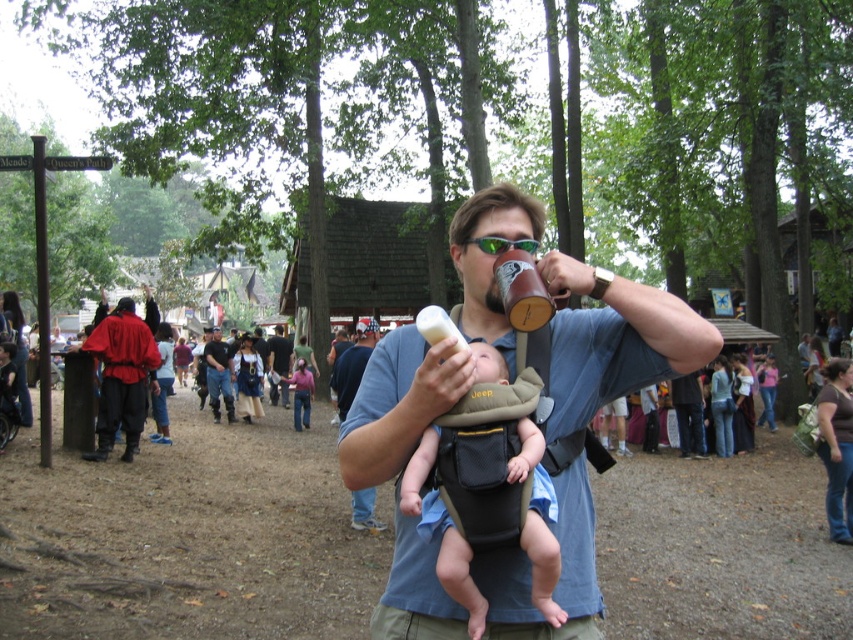
You are a vendor at the medieval fair and need to retrieve your red leather jacket at center from the pile of jackets. Which direction should you move relative to the dark brown leather jacket at center to find it?

The red leather jacket at center is positioned on the right side of dark brown leather jacket at center, so you should move to the right of the dark brown leather jacket at center to find it.